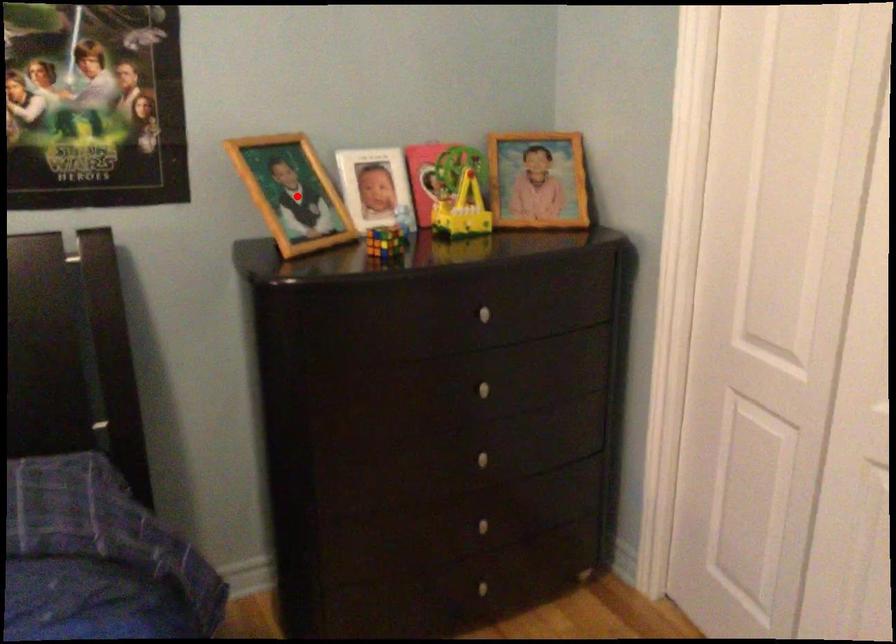
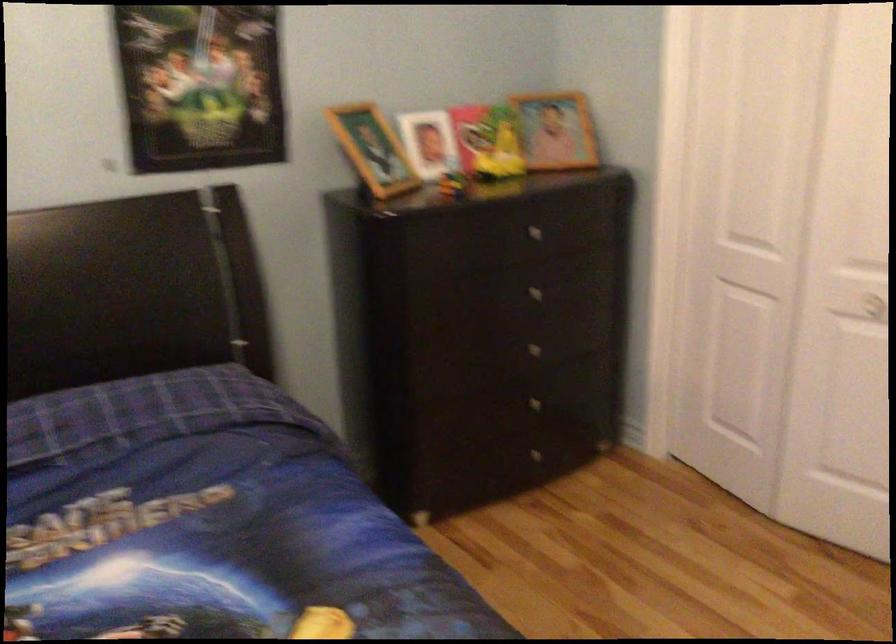
Question: I am providing you with two images of the same scene from different viewpoints. In image1, a red point is highlighted. Considering the same 3D point in image2, which of the following is correct?

Choices:
 (A) It is closer
 (B) It is farther

Answer: (B)